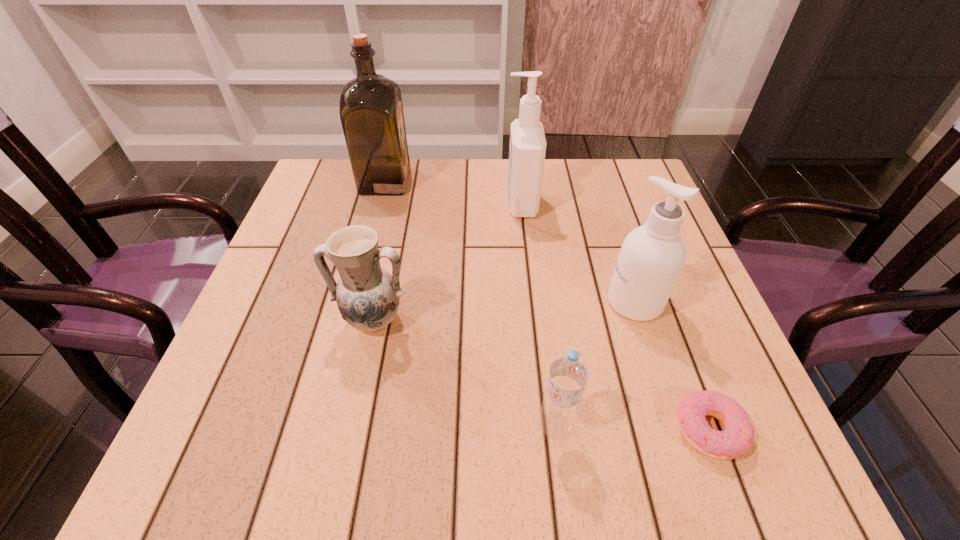
This screenshot has height=540, width=960. I want to click on liquor, so click(x=371, y=111).

Find the location of a particular element. Image resolution: width=960 pixels, height=540 pixels. the farther cleansing agent is located at coordinates (527, 150).

Image resolution: width=960 pixels, height=540 pixels. In order to click on the third tallest object in this screenshot , I will do `click(652, 256)`.

The width and height of the screenshot is (960, 540). Identify the location of the shorter cleansing agent. (652, 256).

Identify the location of pottery. (367, 296).

Image resolution: width=960 pixels, height=540 pixels. I want to click on water bottle, so click(569, 372).

Find the location of `the shortest object`. the shortest object is located at coordinates (738, 436).

Where is `blank space located 0.240m on the label of the liquor`? The width and height of the screenshot is (960, 540). blank space located 0.240m on the label of the liquor is located at coordinates (501, 181).

This screenshot has height=540, width=960. In order to click on vacant space located on the front label of the farther cleansing agent in this screenshot , I will do `click(342, 204)`.

Find the location of a particular element. The height and width of the screenshot is (540, 960). free spot located 0.390m on the front label of the farther cleansing agent is located at coordinates (346, 204).